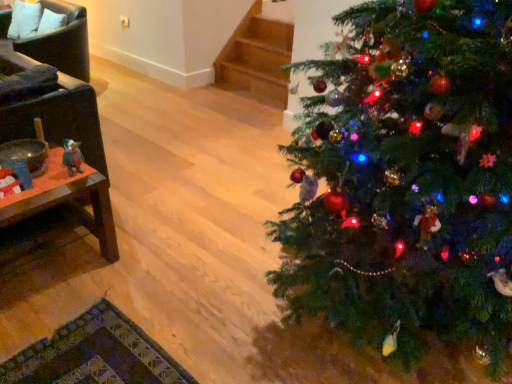
Where is `vacant area to the left of green matte christmas tree at right`? This screenshot has width=512, height=384. vacant area to the left of green matte christmas tree at right is located at coordinates (157, 243).